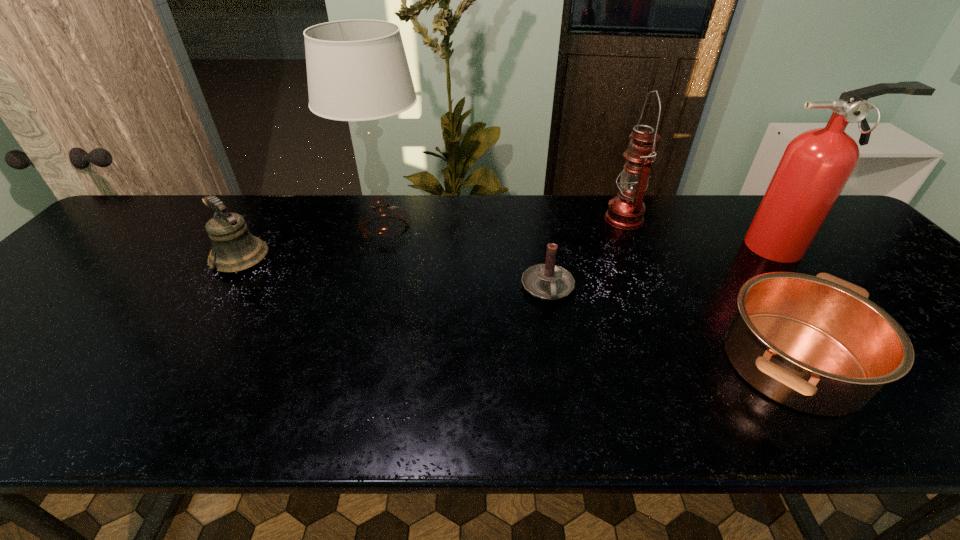
Where is `table lamp`? table lamp is located at coordinates (357, 70).

Find the location of a particular element. The height and width of the screenshot is (540, 960). the tallest object is located at coordinates (357, 70).

This screenshot has width=960, height=540. I want to click on fire extinguisher, so click(x=816, y=165).

I want to click on oil lamp, so click(626, 211).

Image resolution: width=960 pixels, height=540 pixels. I want to click on the leftmost object, so click(234, 248).

At what (x,y) coordinates should I click in order to perform the action: click on the third shortest object. Please return your answer as a coordinate pair (x, y). The height and width of the screenshot is (540, 960). Looking at the image, I should click on (234, 248).

Locate an element on the screen. candle is located at coordinates (548, 281).

You are a GUI agent. You are given a task and a screenshot of the screen. Output one action in this format:
    pyautogui.click(x=<x>, y=<y>)
    Task: Click on the saucepan
    
    Given the screenshot: What is the action you would take?
    pyautogui.click(x=816, y=344)

In order to click on blank area located on the front-facing side of the table lamp in this screenshot , I will do `click(349, 354)`.

This screenshot has width=960, height=540. Find the location of `free spot located 0.100m on the left of the fire extinguisher`. free spot located 0.100m on the left of the fire extinguisher is located at coordinates (705, 247).